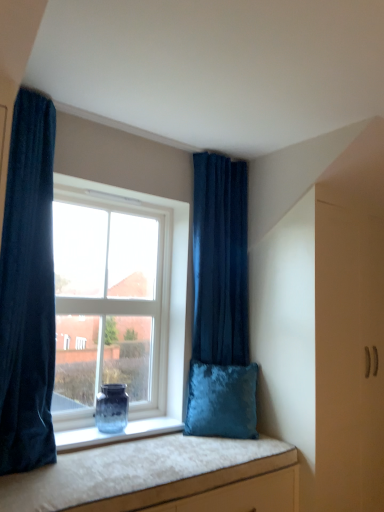
Question: From their relative heights in the image, would you say velvet dark blue curtain at upper center, acting as the 1th curtain starting from the right, is taller or shorter than translucent glass vase at window?

Choices:
 (A) short
 (B) tall

Answer: (B)

Question: Based on their positions, is velvet dark blue curtain at upper center, acting as the 1th curtain starting from the right, located to the left or right of translucent glass vase at window?

Choices:
 (A) left
 (B) right

Answer: (B)

Question: Which object is positioned closest to the velvet dark blue curtain at left, the 2th curtain when ordered from back to front?

Choices:
 (A) velvet dark blue curtain at upper center, which ranks as the 2th curtain in left-to-right order
 (B) clear glass window at center
 (C) velvet cushion at lower center
 (D) translucent glass vase at window
 (E) velvet blue pillow at window

Answer: (B)

Question: Estimate the real-world distances between objects in this image. Which object is farther from the velvet cushion at lower center?

Choices:
 (A) translucent glass vase at window
 (B) clear glass window at center
 (C) velvet dark blue curtain at upper center, marked as the 2th curtain in a front-to-back arrangement
 (D) velvet blue pillow at window
 (E) velvet dark blue curtain at left, positioned as the 1th curtain in front-to-back order

Answer: (C)